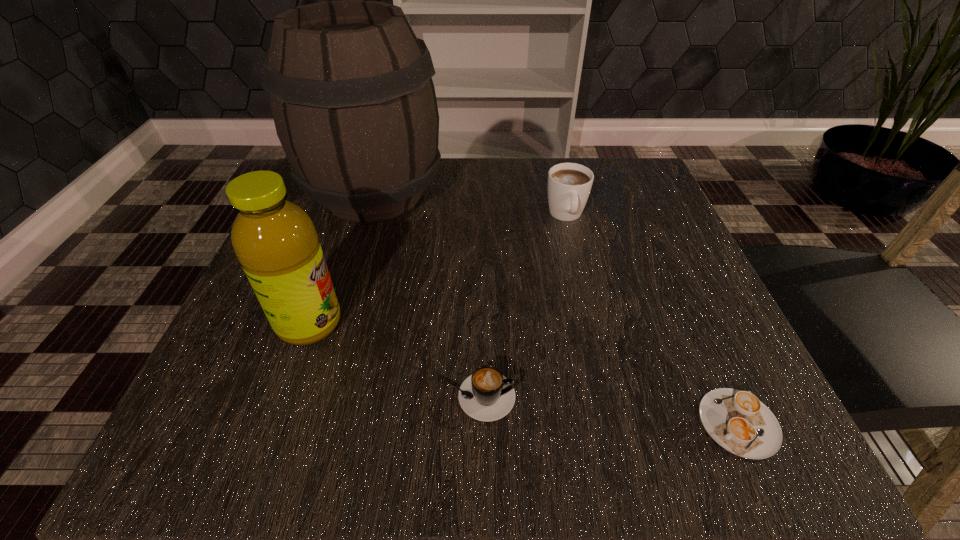
Locate an element on the screen. The width and height of the screenshot is (960, 540). free space located 0.350m on the front label of the fourth shortest object is located at coordinates (568, 323).

The image size is (960, 540). In order to click on free space located with the handle on the side of the tallest cappuccino in this screenshot , I will do `click(600, 357)`.

What are the coordinates of `free space located with the handle on the side of the leftmost cappuccino` in the screenshot? It's located at (672, 397).

Identify the location of free space located on the back of the shortest object. (655, 237).

Where is `wine bucket present at the far edge`? The width and height of the screenshot is (960, 540). wine bucket present at the far edge is located at coordinates (350, 85).

Locate an element on the screen. This screenshot has height=540, width=960. cappuccino positioned at the far edge is located at coordinates (569, 184).

Identify the location of wine bucket present at the left edge. (350, 85).

This screenshot has width=960, height=540. I want to click on fruit juice that is positioned at the left edge, so click(275, 240).

Identify the location of object situated at the right edge. Image resolution: width=960 pixels, height=540 pixels. (738, 421).

Locate an element on the screen. This screenshot has height=540, width=960. object located in the far left corner section of the desktop is located at coordinates (350, 85).